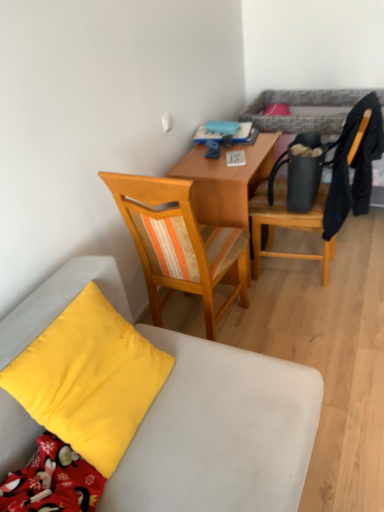
Question: From a real-world perspective, is matte black chair at upper right, the first chair in the right-to-left sequence, physically below wooden chair at center, arranged as the 2th chair when viewed from the right?

Choices:
 (A) no
 (B) yes

Answer: (A)

Question: Is matte black chair at upper right, the first chair in the right-to-left sequence, next to wooden chair at center, the second chair positioned from the left, and touching it?

Choices:
 (A) no
 (B) yes

Answer: (A)

Question: Is matte black chair at upper right, which appears as the 3th chair when viewed from the left, to the left of wooden chair at center, arranged as the 2th chair when viewed from the right, from the viewer's perspective?

Choices:
 (A) yes
 (B) no

Answer: (B)

Question: From a real-world perspective, does matte black chair at upper right, which appears as the 3th chair when viewed from the left, stand above wooden chair at center, the second chair positioned from the left?

Choices:
 (A) no
 (B) yes

Answer: (B)

Question: Does matte black chair at upper right, which appears as the 3th chair when viewed from the left, turn towards wooden chair at center, the second chair positioned from the left?

Choices:
 (A) yes
 (B) no

Answer: (B)

Question: From the image's perspective, would you say matte black chair at upper right, the first chair in the right-to-left sequence, is positioned over wooden chair at center, arranged as the 2th chair when viewed from the right?

Choices:
 (A) yes
 (B) no

Answer: (A)

Question: Is wooden chair at center, the second chair positioned from the left, looking in the opposite direction of matte black chair at upper right, which appears as the 3th chair when viewed from the left?

Choices:
 (A) yes
 (B) no

Answer: (B)

Question: Can you confirm if wooden chair at center, the second chair positioned from the left, is taller than matte black chair at upper right, the first chair in the right-to-left sequence?

Choices:
 (A) no
 (B) yes

Answer: (A)

Question: Is wooden chair at center, arranged as the 2th chair when viewed from the right, to the right of matte black chair at upper right, the first chair in the right-to-left sequence, from the viewer's perspective?

Choices:
 (A) no
 (B) yes

Answer: (A)

Question: Is wooden chair at center, arranged as the 2th chair when viewed from the right, aimed at matte black chair at upper right, the first chair in the right-to-left sequence?

Choices:
 (A) yes
 (B) no

Answer: (B)

Question: Is matte black chair at upper right, which appears as the 3th chair when viewed from the left, inside wooden chair at center, arranged as the 2th chair when viewed from the right?

Choices:
 (A) no
 (B) yes

Answer: (A)

Question: From the image's perspective, is wooden chair at center, the second chair positioned from the left, on matte black chair at upper right, the first chair in the right-to-left sequence?

Choices:
 (A) yes
 (B) no

Answer: (B)

Question: Considering the relative sizes of yellow matte pillow at lower left and matte black chair at upper right, which appears as the 3th chair when viewed from the left, in the image provided, is yellow matte pillow at lower left taller than matte black chair at upper right, which appears as the 3th chair when viewed from the left,?

Choices:
 (A) yes
 (B) no

Answer: (B)